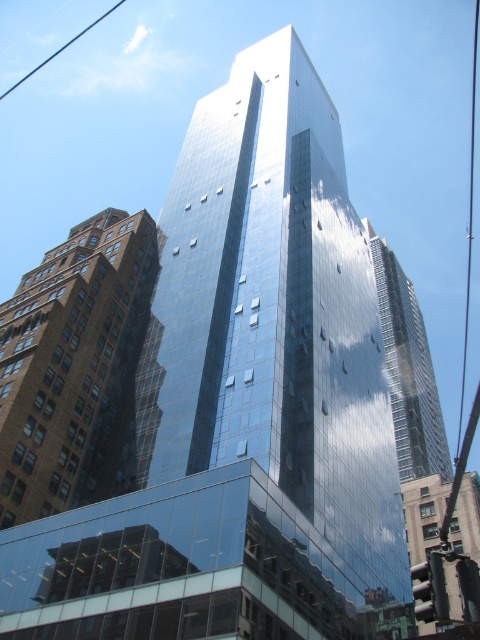
Question: Can you confirm if brown brick building at left is positioned above shiny glass skyscraper at center?

Choices:
 (A) no
 (B) yes

Answer: (B)

Question: Among these points, which one is nearest to the camera?

Choices:
 (A) (54, 472)
 (B) (417, 333)

Answer: (A)

Question: Which of the following is the closest to the observer?

Choices:
 (A) brown brick building at left
 (B) shiny glass skyscraper at center

Answer: (A)

Question: Which point appears farthest from the camera in this image?

Choices:
 (A) (427, 422)
 (B) (37, 448)

Answer: (A)

Question: Does brown brick building at left have a larger size compared to shiny glass skyscraper at center?

Choices:
 (A) no
 (B) yes

Answer: (A)

Question: Is brown brick building at left wider than shiny glass skyscraper at center?

Choices:
 (A) yes
 (B) no

Answer: (B)